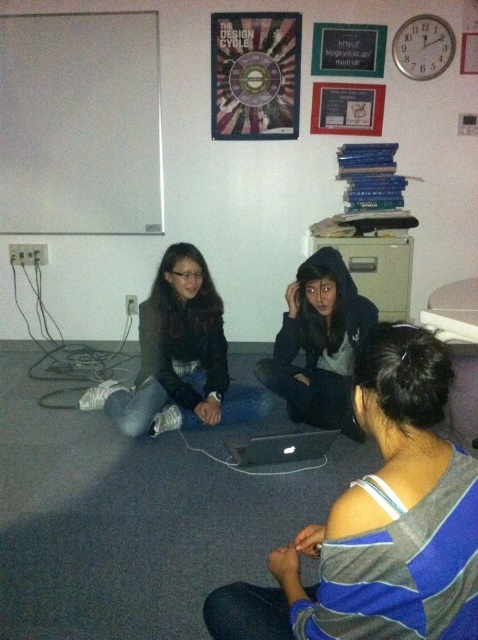
Does gray striped shirt at lower right have a lesser height compared to metallic circular object at upper center?

No, gray striped shirt at lower right is not shorter than metallic circular object at upper center.

Can you confirm if gray striped shirt at lower right is positioned below metallic circular object at upper center?

Yes, gray striped shirt at lower right is below metallic circular object at upper center.

Is point (423, 515) behind point (239, 100)?

No, it is not.

At what (x,y) coordinates should I click in order to perform the action: click on gray striped shirt at lower right. Please return your answer as a coordinate pair (x, y). Looking at the image, I should click on (380, 522).

Between matte black jacket at center and metallic circular object at upper center, which one is positioned lower?

matte black jacket at center

Can you confirm if matte black jacket at center is positioned below metallic circular object at upper center?

Correct, matte black jacket at center is located below metallic circular object at upper center.

Identify the location of matte black jacket at center. Image resolution: width=478 pixels, height=640 pixels. (178, 356).

Does point (127, 205) lie in front of point (256, 83)?

No, it is not.

How much distance is there between white matte board at upper left and metallic circular object at upper center?

white matte board at upper left is 33.50 inches away from metallic circular object at upper center.

Which is in front, point (89, 80) or point (267, 96)?

Positioned in front is point (89, 80).

The height and width of the screenshot is (640, 478). Identify the location of white matte board at upper left. (79, 124).